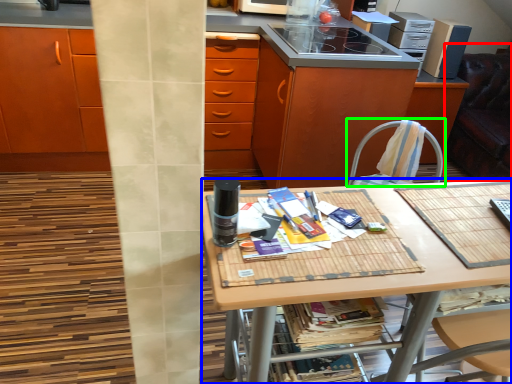
Question: Considering the real-world distances, which object is closest to swivel chair (highlighted by a red box)? desk (highlighted by a blue box) or chair (highlighted by a green box).

Choices:
 (A) desk
 (B) chair

Answer: (B)